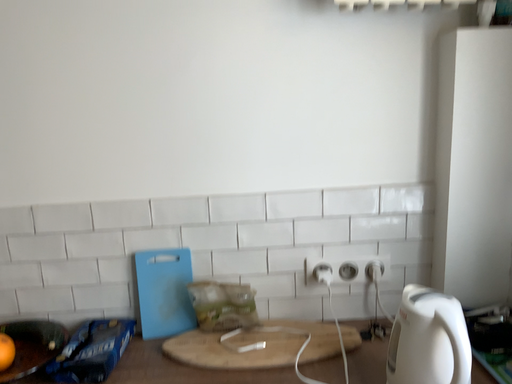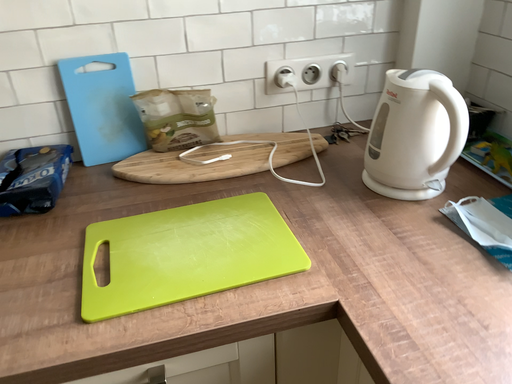
Question: How did the camera likely rotate when shooting the video?

Choices:
 (A) rotated right
 (B) rotated left

Answer: (A)